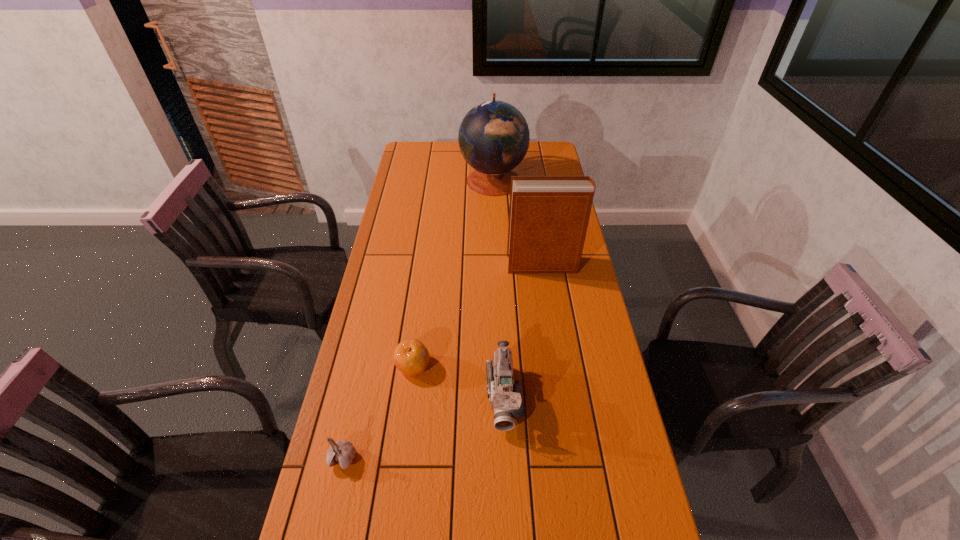
The image size is (960, 540). Find the location of `free space located 0.050m on the open cover of the second farthest object`. free space located 0.050m on the open cover of the second farthest object is located at coordinates (493, 265).

Image resolution: width=960 pixels, height=540 pixels. In order to click on vacant space situated 0.120m on the open cover of the second farthest object in this screenshot , I will do `click(474, 265)`.

Find the location of `vacant area located on the front-facing side of the third tallest object`. vacant area located on the front-facing side of the third tallest object is located at coordinates (510, 517).

Identify the location of vacant space located on the back of the leftmost object. Image resolution: width=960 pixels, height=540 pixels. (361, 378).

I want to click on vacant space located on the back of the fourth object from right to left, so click(420, 312).

You are a GUI agent. You are given a task and a screenshot of the screen. Output one action in this format:
    pyautogui.click(x=<x>, y=<y>)
    Task: Click on the object that is positioned at the far edge
    Image resolution: width=960 pixels, height=540 pixels.
    Given the screenshot: What is the action you would take?
    pyautogui.click(x=494, y=137)

The width and height of the screenshot is (960, 540). I want to click on garlic that is positioned at the left edge, so click(341, 452).

Where is `clementine that is positioned at the left edge`? The width and height of the screenshot is (960, 540). clementine that is positioned at the left edge is located at coordinates (411, 357).

Identify the location of object at the right edge. Image resolution: width=960 pixels, height=540 pixels. (548, 215).

Where is `vacant region at the left edge of the desktop`? vacant region at the left edge of the desktop is located at coordinates (400, 329).